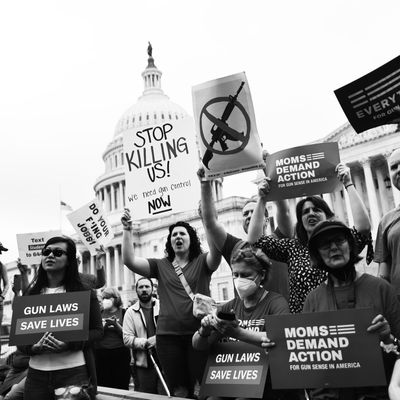
In order to click on poster in this screenshot , I will do 340,368.